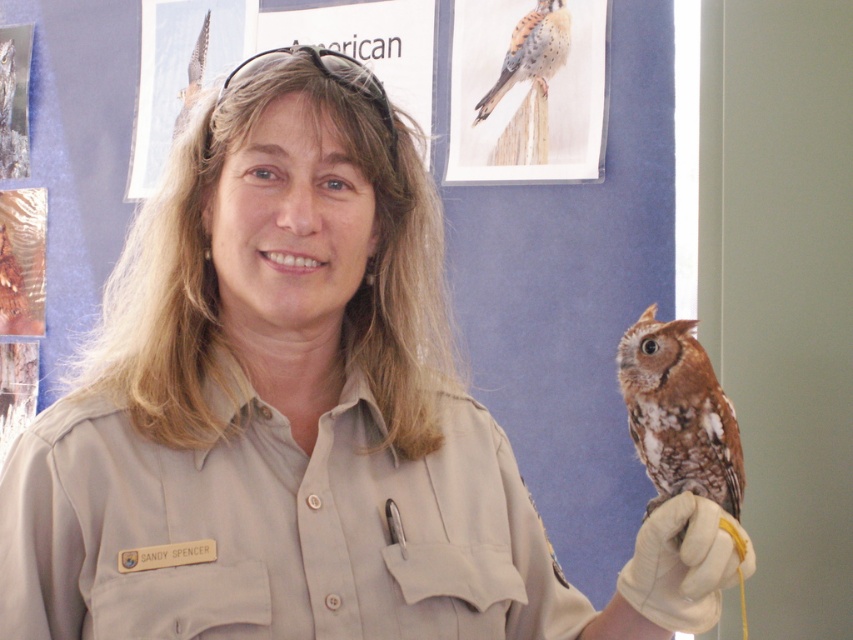
You are a photographer trying to capture a closeup of the brown speckled feathers at upper center without the white leather glove at lower right appearing in the frame. Is it possible to do so based on their positions?

The white leather glove at lower right is below the brown speckled feathers at upper center, so adjusting the camera angle upward could exclude the glove from the frame while focusing on the feathers.

You are a photographer trying to capture the exact position of the brown speckled owl at right in the image. What are the coordinates of the owl?

The coordinates of the brown speckled owl at right are at point (677,413).

You are a photographer trying to capture a closeup shot of the brown speckled owl at right and the white leather glove at lower right. Can you fit both subjects into the frame if your camera has a minimum focus distance of 15 centimeters?

The brown speckled owl at right is 15.91 centimeters from the white leather glove at lower right. Since the minimum focus distance is 15 centimeters, the camera can focus on both subjects as the distance between them is slightly more than the minimum requirement.